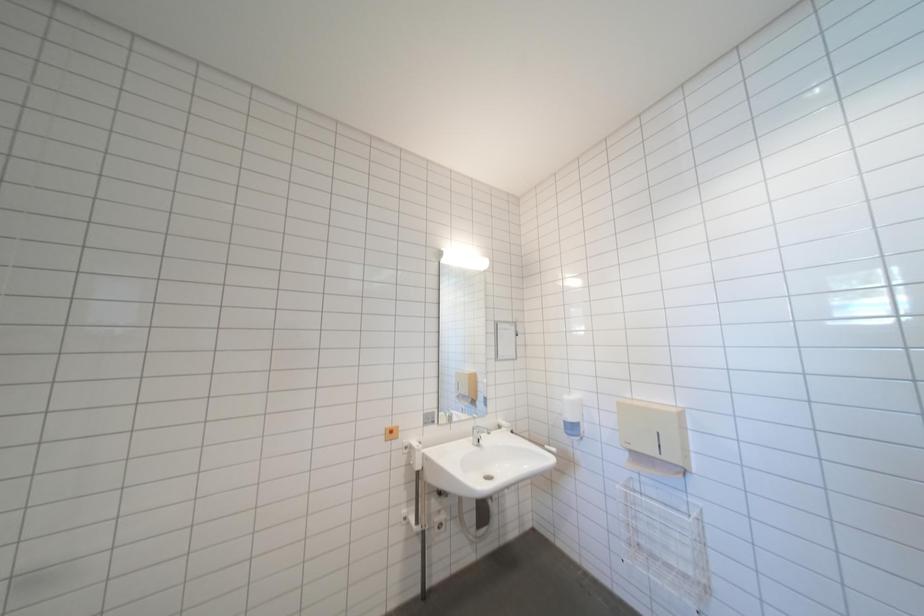
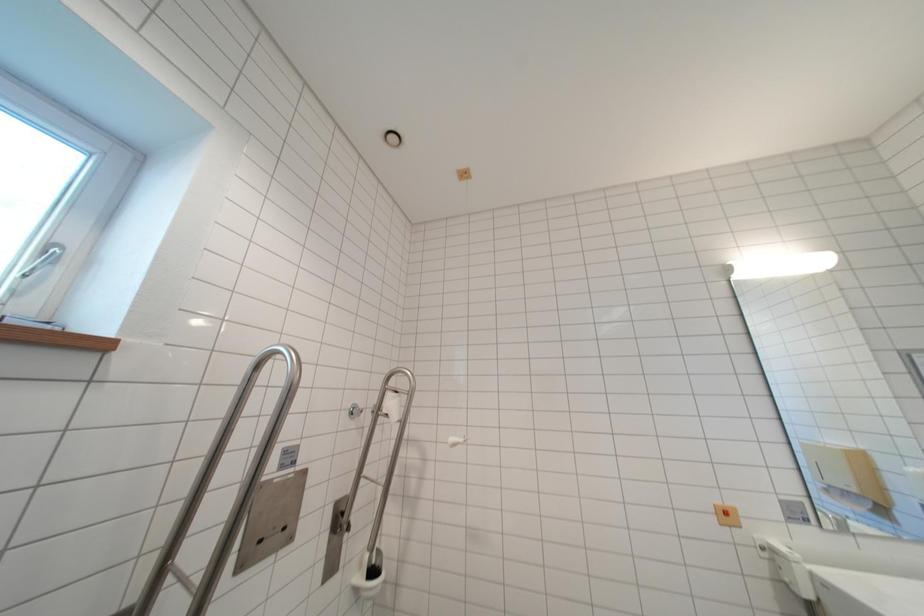
Question: The camera is either moving clockwise (left) or counter-clockwise (right) around the object. The first image is from the beginning of the video and the second image is from the end. Is the camera moving left or right when shooting the video?

Choices:
 (A) Left
 (B) Right

Answer: (B)